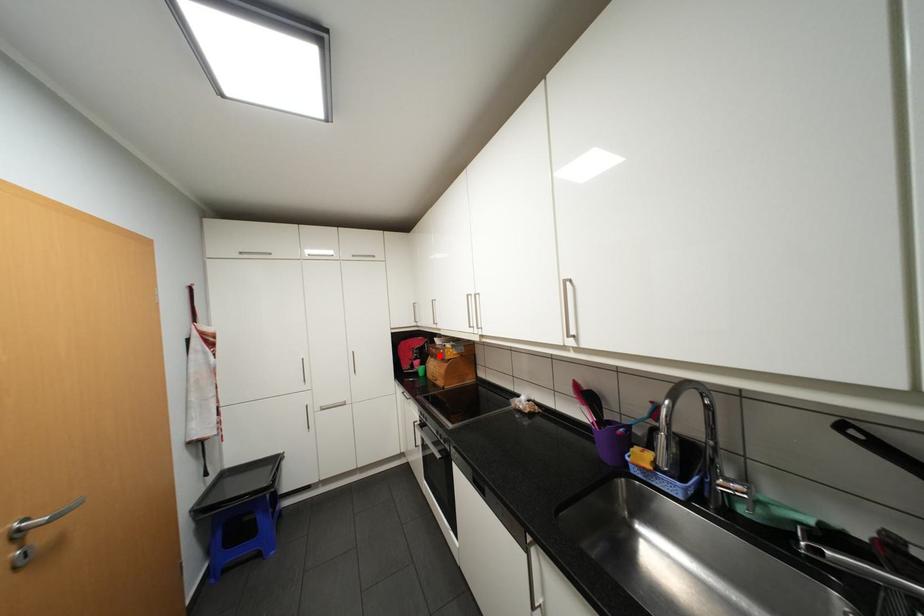
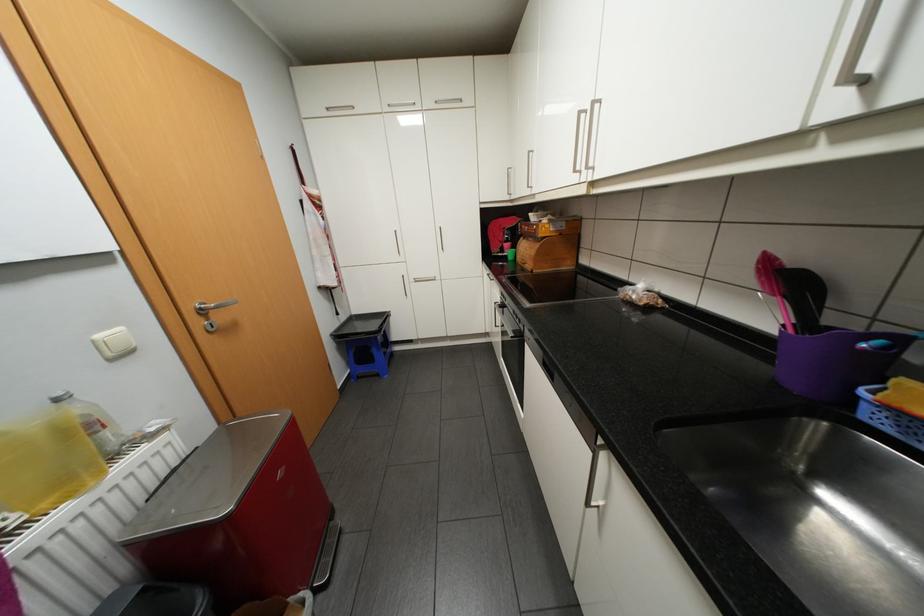
Question: I am providing you with two images of the same scene from different viewpoints. Given a red point in image1, look at the same physical point in image2. Is it:

Choices:
 (A) Closer to the viewpoint
 (B) Farther from the viewpoint

Answer: (A)